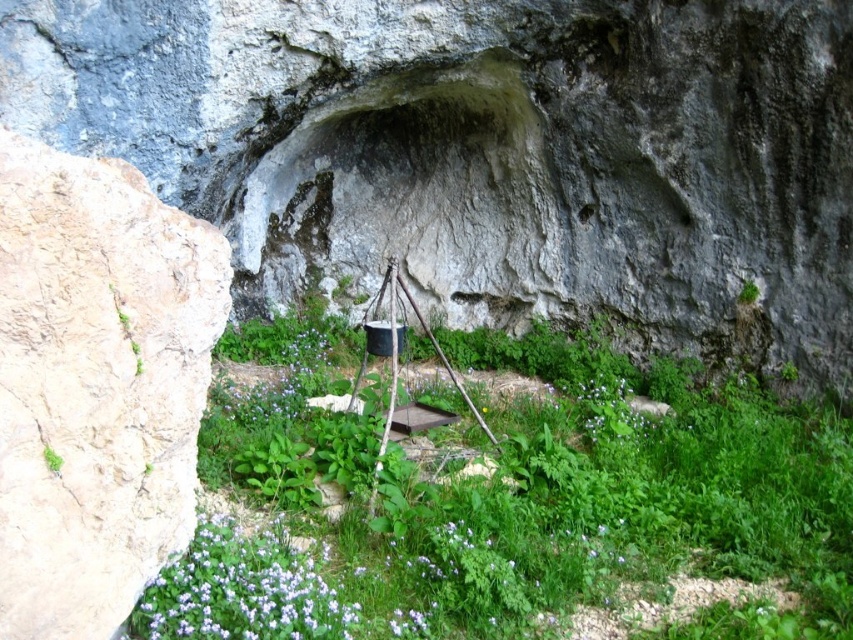
Question: Can you confirm if purple matte flower at lower left is positioned above purple leafy plant at center?

Choices:
 (A) no
 (B) yes

Answer: (A)

Question: Which object appears farthest from the camera in this image?

Choices:
 (A) green leafy grass at center
 (B) rough stone cave at center
 (C) purple matte flower at lower left
 (D) beige rough rock at left

Answer: (B)

Question: Which object is the farthest from the purple matte flower at center?

Choices:
 (A) purple matte flower at lower left
 (B) beige rough rock at left
 (C) rough stone cave at center
 (D) green leafy grass at center

Answer: (B)

Question: Observing the image, what is the correct spatial positioning of purple matte flower at lower left in reference to purple matte flower at center?

Choices:
 (A) above
 (B) below

Answer: (B)

Question: Is beige rough rock at left thinner than purple matte flower at lower left?

Choices:
 (A) yes
 (B) no

Answer: (A)

Question: Which is farther from the purple matte flower at lower left?

Choices:
 (A) purple matte flower at center
 (B) green leafy grass at center
 (C) beige rough rock at left
 (D) purple leafy plant at center

Answer: (D)